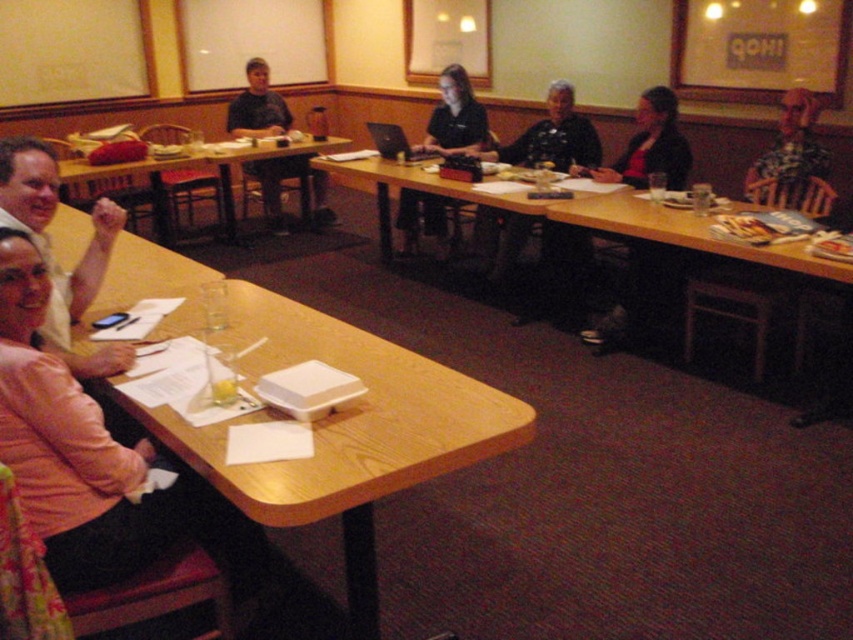
Question: Which object is farther from the camera taking this photo?

Choices:
 (A) pink fabric jacket at lower left
 (B) dark gray sweater at center

Answer: (B)

Question: Among these objects, which one is farthest from the camera?

Choices:
 (A) pink fabric jacket at lower left
 (B) black matte jacket at center

Answer: (B)

Question: Is dark gray sweater at center to the right of checkered shirt at upper right from the viewer's perspective?

Choices:
 (A) no
 (B) yes

Answer: (A)

Question: Is wooden table at lower right above black matte jacket at center?

Choices:
 (A) no
 (B) yes

Answer: (A)

Question: Which point is closer to the camera?

Choices:
 (A) wooden table at lower left
 (B) pink fabric jacket at lower left
 (C) black matte jacket at center
 (D) checkered shirt at upper right

Answer: (A)

Question: Can you confirm if pink fabric jacket at lower left is thinner than black matte laptop at center?

Choices:
 (A) yes
 (B) no

Answer: (A)